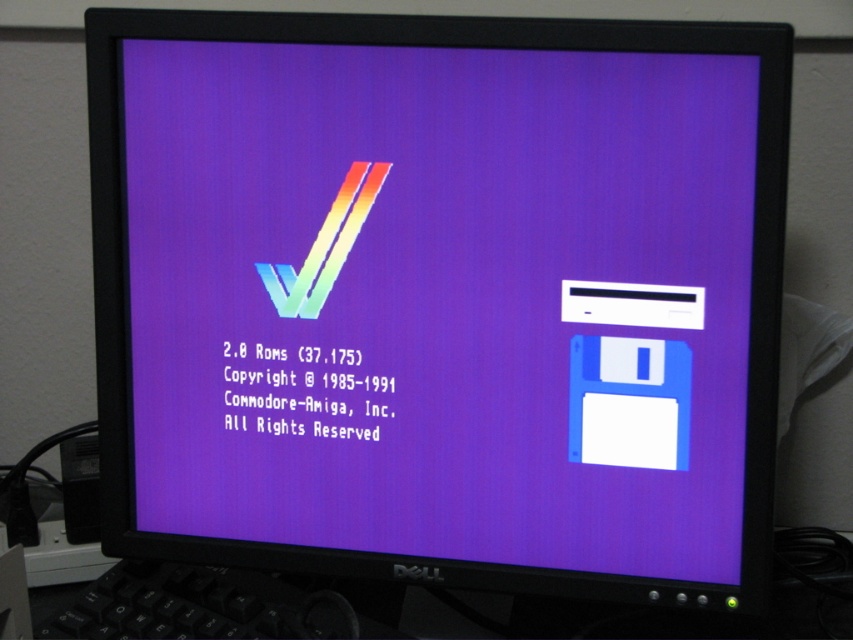
You are setting up a Commodore Amiga computer and need to place a floppy disk and a keyboard. Based on the image, where should you position the matte plastic floppy disk at right relative to the black matte keyboard at lower left?

The matte plastic floppy disk at right should be placed on the right side of the black matte keyboard at lower left according to the image.

You are a graphic designer working on a project that requires precise placement of elements on the Commodore Amiga screen displayed on the Dell monitor. You need to place a new icon between the two points labeled point (473, 221) and point (51, 636). Given their positions, which point is closer to the viewer, and where should you position the icon to ensure it appears in front of both points?

Point (473, 221) is closer to the viewer than point (51, 636). To position the icon in front of both points, place it between them but closer to point (473, 221) since it is nearer to the viewer.